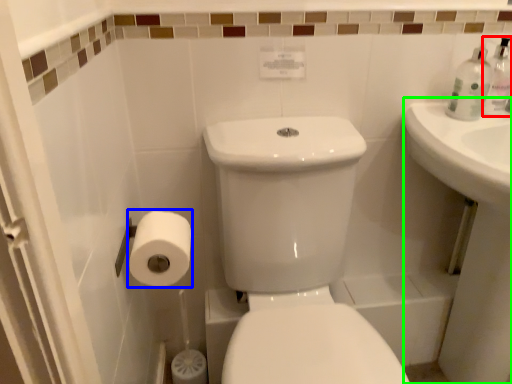
Question: Considering the real-world distances, which object is farthest from soap dispenser (highlighted by a red box)? toilet paper (highlighted by a blue box) or counter top (highlighted by a green box)?

Choices:
 (A) toilet paper
 (B) counter top

Answer: (A)